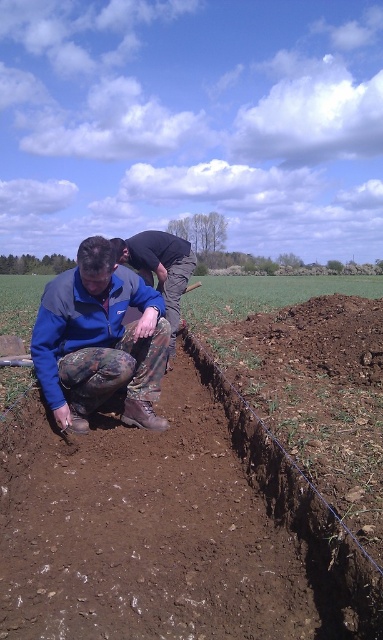
Question: Which is farther from the brown soil at center?

Choices:
 (A) blue camouflage pants at center
 (B) camouflage pants at lower center

Answer: (A)

Question: Observing the image, what is the correct spatial positioning of brown soil at center in reference to camouflage pants at lower center?

Choices:
 (A) below
 (B) above

Answer: (B)

Question: Is brown soil at center wider than camouflage pants at lower center?

Choices:
 (A) no
 (B) yes

Answer: (B)

Question: Is camouflage pants at lower center smaller than blue camouflage pants at center?

Choices:
 (A) no
 (B) yes

Answer: (B)

Question: Which of the following is the farthest from the observer?

Choices:
 (A) camouflage pants at lower center
 (B) brown soil at center

Answer: (A)

Question: Which object is farther from the camera taking this photo?

Choices:
 (A) camouflage pants at lower center
 (B) blue camouflage pants at center
 (C) brown soil at center

Answer: (B)